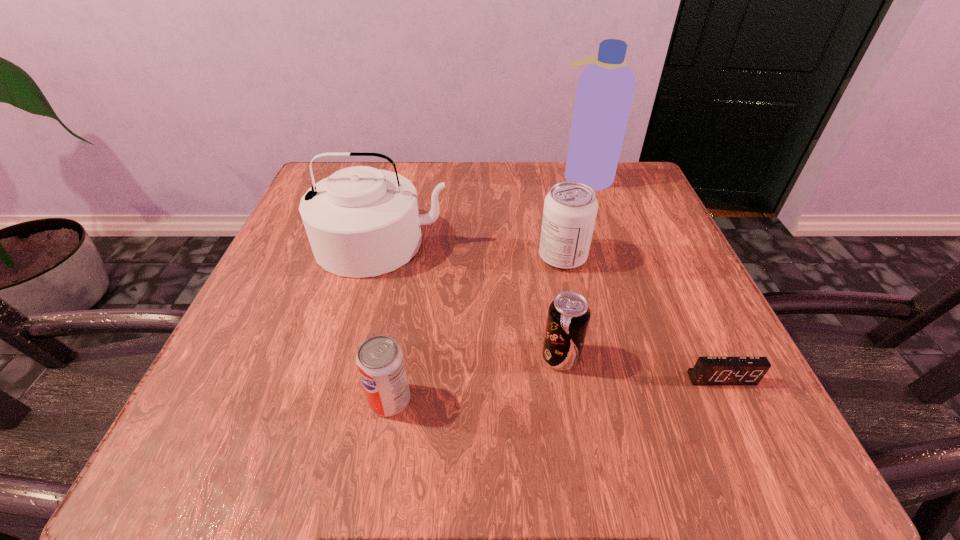
The height and width of the screenshot is (540, 960). I want to click on vacant area between the second tallest object and the second farthest soda, so click(x=471, y=300).

At what (x,y) coordinates should I click in order to perform the action: click on vacant space that's between the second farthest soda and the second tallest object. Please return your answer as a coordinate pair (x, y). The height and width of the screenshot is (540, 960). Looking at the image, I should click on (471, 300).

Where is `vacant area that lies between the second nearest soda and the kettle`? vacant area that lies between the second nearest soda and the kettle is located at coordinates (471, 300).

Where is `vacant space in between the shortest object and the farthest soda`? This screenshot has height=540, width=960. vacant space in between the shortest object and the farthest soda is located at coordinates (642, 318).

The image size is (960, 540). What are the coordinates of `object that is the fourth closest to the second farthest soda` in the screenshot? It's located at (361, 221).

Locate which object ranks fourth in proximity to the shortest object. Please provide its 2D coordinates. Your answer should be formatted as a tuple, i.e. [(x, y)], where the tuple contains the x and y coordinates of a point satisfying the conditions above.

[(361, 221)]

You are a GUI agent. You are given a task and a screenshot of the screen. Output one action in this format:
    pyautogui.click(x=<x>, y=<y>)
    Task: Click on the soda that is the closest to the nearest soda
    The width and height of the screenshot is (960, 540).
    Given the screenshot: What is the action you would take?
    pyautogui.click(x=568, y=318)

Select which soda appears as the second closest to the fourth shortest object. Please provide its 2D coordinates. Your answer should be formatted as a tuple, i.e. [(x, y)], where the tuple contains the x and y coordinates of a point satisfying the conditions above.

[(380, 362)]

At what (x,y) coordinates should I click in order to perform the action: click on free space that satisfies the following two spatial constraints: 1. on the back side of the leftmost soda; 2. on the left side of the third tallest object. Please return your answer as a coordinate pair (x, y). Looking at the image, I should click on (414, 257).

This screenshot has height=540, width=960. I want to click on blank area in the image that satisfies the following two spatial constraints: 1. on the spout of the farthest soda; 2. on the left side of the kettle, so click(378, 257).